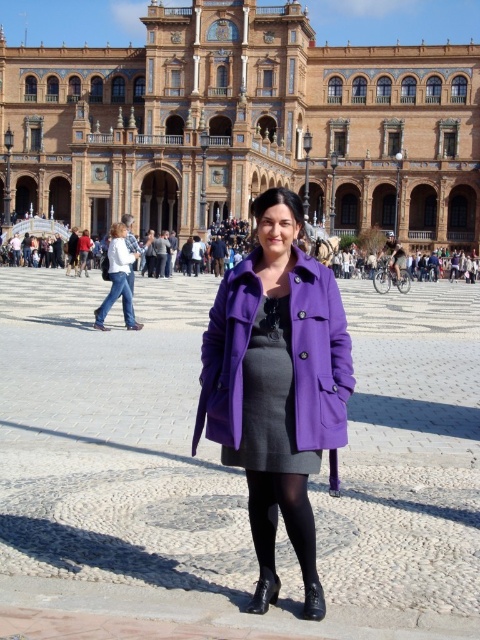
Question: Among these points, which one is farthest from the camera?

Choices:
 (A) pyautogui.click(x=265, y=380)
 (B) pyautogui.click(x=127, y=296)
 (C) pyautogui.click(x=286, y=484)
 (D) pyautogui.click(x=175, y=145)

Answer: (D)

Question: Does purple woolen coat at center have a larger size compared to denim jeans at lower left?

Choices:
 (A) yes
 (B) no

Answer: (A)

Question: In this image, where is matte brown building at center located relative to matte gray dress at center?

Choices:
 (A) above
 (B) below

Answer: (A)

Question: Which of the following is the farthest from the observer?

Choices:
 (A) denim jeans at left
 (B) purple woolen coat at center

Answer: (A)

Question: Is purple woolen coat at center closer to camera compared to denim jeans at lower left?

Choices:
 (A) no
 (B) yes

Answer: (B)

Question: Among these points, which one is nearest to the camera?

Choices:
 (A) (264, 81)
 (B) (314, 371)

Answer: (B)